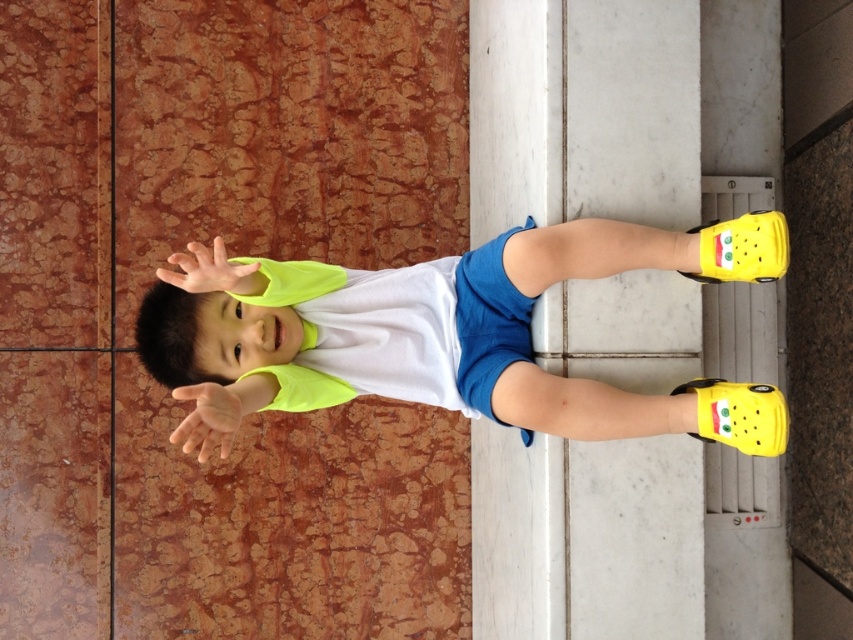
This screenshot has width=853, height=640. What do you see at coordinates (616, 108) in the screenshot?
I see `white smooth pillar at center` at bounding box center [616, 108].

Is white smooth pillar at center smaller than yellow matte shoes at lower right?

Incorrect, white smooth pillar at center is not smaller in size than yellow matte shoes at lower right.

Measure the distance between white smooth pillar at center and camera.

white smooth pillar at center is 7.23 feet away from camera.

The image size is (853, 640). Identify the location of white smooth pillar at center. (616, 108).